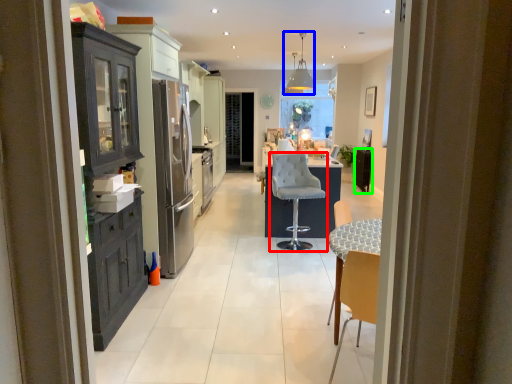
Question: Considering the real-world distances, which object is farthest from chair (highlighted by a red box)? light fixture (highlighted by a blue box) or appliance (highlighted by a green box)?

Choices:
 (A) light fixture
 (B) appliance

Answer: (A)